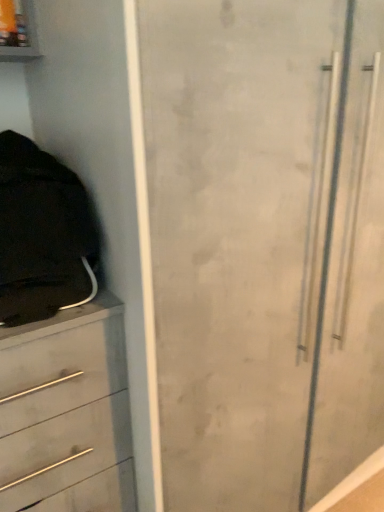
Image resolution: width=384 pixels, height=512 pixels. I want to click on black matte laptop at left, so click(x=42, y=234).

Describe the element at coordinates (42, 234) in the screenshot. I see `black matte laptop at left` at that location.

The image size is (384, 512). Find the location of `black matte laptop at left`. black matte laptop at left is located at coordinates (42, 234).